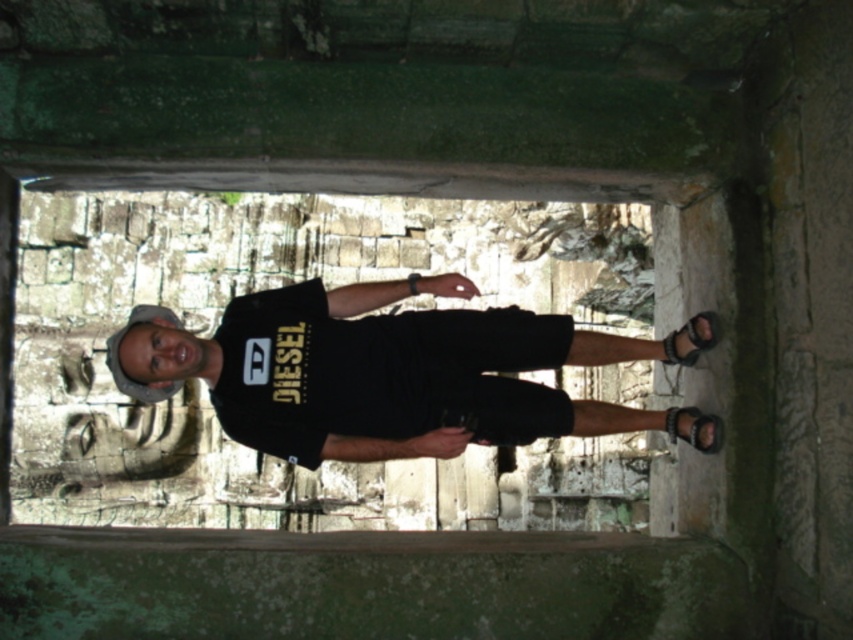
Locate an element on the screen. The width and height of the screenshot is (853, 640). black matte t-shirt at center is located at coordinates (381, 371).

Consider the image. Who is taller, black matte t-shirt at center or black leather sandal at lower right?

black matte t-shirt at center is taller.

Which is in front, point (276, 304) or point (717, 420)?

Positioned in front is point (717, 420).

At what (x,y) coordinates should I click in order to perform the action: click on black matte t-shirt at center. Please return your answer as a coordinate pair (x, y). Looking at the image, I should click on (381, 371).

Does point (349, 333) lie in front of point (689, 333)?

No, (349, 333) is behind (689, 333).

Does point (280, 346) lie behind point (694, 353)?

Yes, point (280, 346) is behind point (694, 353).

Locate an element on the screen. The height and width of the screenshot is (640, 853). black matte t-shirt at center is located at coordinates (381, 371).

Identify the location of black matte t-shirt at center. (381, 371).

Which is in front, point (711, 321) or point (668, 412)?

Point (711, 321) is in front.

Is point (663, 344) in front of point (715, 438)?

That is False.

What do you see at coordinates (689, 339) in the screenshot? I see `black leather sandal at right` at bounding box center [689, 339].

Identify the location of black leather sandal at right. (689, 339).